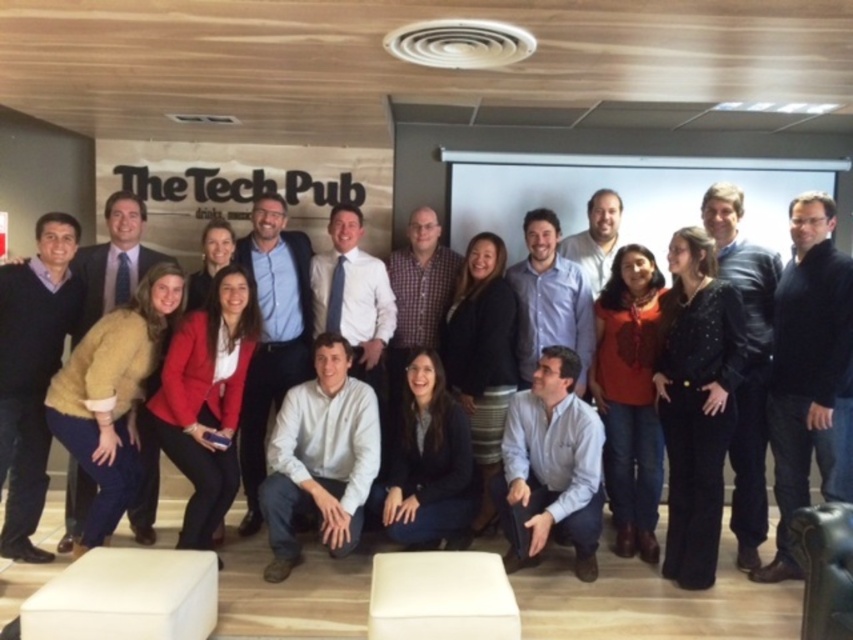
Question: Which point appears farthest from the camera in this image?

Choices:
 (A) (x=187, y=371)
 (B) (x=646, y=264)
 (C) (x=694, y=429)

Answer: (B)

Question: Observing the image, what is the correct spatial positioning of black matte jacket at center in reference to matte black jacket at center?

Choices:
 (A) above
 (B) below

Answer: (B)

Question: Which point is closer to the camera?

Choices:
 (A) black textured pants at lower right
 (B) black sweater at center

Answer: (B)

Question: In this image, where is matte red blazer at center located relative to matte red sweater at center?

Choices:
 (A) above
 (B) below

Answer: (A)

Question: Is black sweater at center smaller than black textured pants at lower right?

Choices:
 (A) yes
 (B) no

Answer: (B)

Question: Among these points, which one is nearest to the camera?

Choices:
 (A) 790,360
 (B) 164,449
 (C) 10,332
 (D) 598,372

Answer: (C)